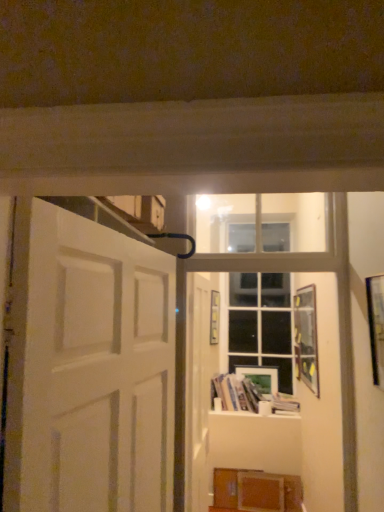
Question: Are white matte door at center, positioned as the 2th door in front-to-back order, and white glossy bookshelf at lower center located far from each other?

Choices:
 (A) yes
 (B) no

Answer: (A)

Question: From a real-world perspective, does white matte door at center, arranged as the 2th door when viewed from the left, sit lower than white glossy bookshelf at lower center?

Choices:
 (A) yes
 (B) no

Answer: (B)

Question: Considering the relative positions of white matte door at center, acting as the 1th door starting from the right, and white glossy bookshelf at lower center in the image provided, is white matte door at center, acting as the 1th door starting from the right, behind white glossy bookshelf at lower center?

Choices:
 (A) no
 (B) yes

Answer: (A)

Question: Is white matte door at center, arranged as the 2th door when viewed from the left, taller than white glossy bookshelf at lower center?

Choices:
 (A) yes
 (B) no

Answer: (A)

Question: Is white matte door at center, positioned as the 2th door in front-to-back order, outside white glossy bookshelf at lower center?

Choices:
 (A) no
 (B) yes

Answer: (B)

Question: Looking at their shapes, would you say metallic silver picture frame at right, the fourth picture frame viewed from the back, is wider or thinner than wooden picture frame at upper right, arranged as the first picture frame when viewed from the right?

Choices:
 (A) wide
 (B) thin

Answer: (A)

Question: From the image's perspective, relative to wooden picture frame at upper right, acting as the 3th picture frame starting from the back, is metallic silver picture frame at right, which appears as the 3th picture frame when viewed from the left, above or below?

Choices:
 (A) above
 (B) below

Answer: (A)

Question: In the image, is metallic silver picture frame at right, which appears as the 3th picture frame when viewed from the left, positioned in front of or behind wooden picture frame at upper right, arranged as the first picture frame when viewed from the right?

Choices:
 (A) behind
 (B) front

Answer: (B)

Question: Considering the positions of metallic silver picture frame at right, the fourth picture frame viewed from the back, and wooden picture frame at upper right, which ranks as the second picture frame in front-to-back order, in the image, is metallic silver picture frame at right, the fourth picture frame viewed from the back, bigger or smaller than wooden picture frame at upper right, which ranks as the second picture frame in front-to-back order,?

Choices:
 (A) big
 (B) small

Answer: (B)

Question: From a real-world perspective, is clear glass window at center physically located above or below white glossy bookshelf at center, the 2th book in the right-to-left sequence?

Choices:
 (A) below
 (B) above

Answer: (B)

Question: Considering the positions of clear glass window at center and white glossy bookshelf at center, the 1th book viewed from the left, in the image, is clear glass window at center taller or shorter than white glossy bookshelf at center, the 1th book viewed from the left,?

Choices:
 (A) tall
 (B) short

Answer: (A)

Question: Would you say clear glass window at center is to the left or to the right of white glossy bookshelf at center, the 2th book in the right-to-left sequence, in the picture?

Choices:
 (A) left
 (B) right

Answer: (B)

Question: From the image's perspective, is clear glass window at center positioned above or below white glossy bookshelf at center, the 2th book in the right-to-left sequence?

Choices:
 (A) below
 (B) above

Answer: (B)

Question: Would you say matte wooden picture frame at center, acting as the first picture frame starting from the back, is to the left or to the right of white matte door at center, placed as the first door when sorted from back to front, in the picture?

Choices:
 (A) right
 (B) left

Answer: (A)

Question: From the image's perspective, is matte wooden picture frame at center, the second picture frame when ordered from left to right, above or below white matte door at center, arranged as the 2th door when viewed from the left?

Choices:
 (A) below
 (B) above

Answer: (A)